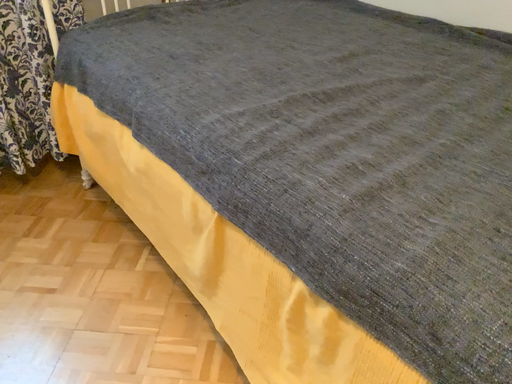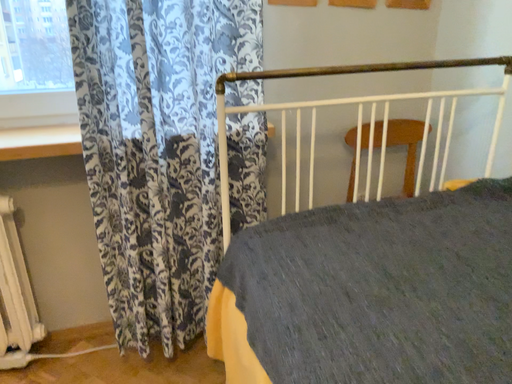
Question: Which way did the camera rotate in the video?

Choices:
 (A) rotated left
 (B) rotated right

Answer: (A)